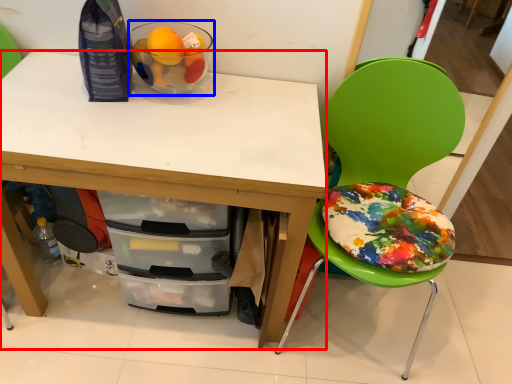
Question: Which object appears closest to the camera in this image, desk (highlighted by a red box) or glass bowl (highlighted by a blue box)?

Choices:
 (A) desk
 (B) glass bowl

Answer: (A)